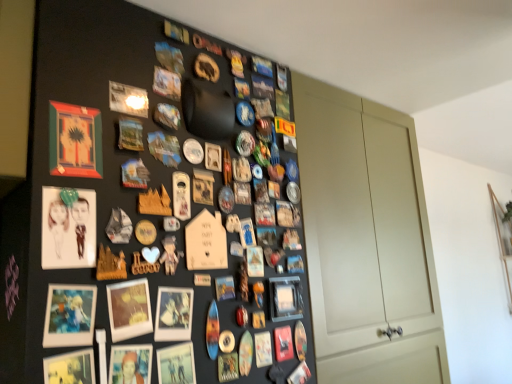
Question: Which is correct: matte wooden picture frame at upper left, arranged as the eighth picture frame when viewed from the right, is inside matte wooden picture frame at center, marked as the 5th picture frame in a left-to-right arrangement, or outside of it?

Choices:
 (A) outside
 (B) inside

Answer: (A)

Question: From a real-world perspective, is matte wooden picture frame at upper left, arranged as the first picture frame when viewed from the left, above or below matte wooden picture frame at center, the fourth picture frame in the right-to-left sequence?

Choices:
 (A) above
 (B) below

Answer: (A)

Question: Considering the real-world distances, which object is farthest from the matte black picture frame at lower right, the first picture frame in the right-to-left sequence?

Choices:
 (A) matte black picture frame at lower left, placed as the fourth picture frame when sorted from left to right
 (B) matte plastic picture frame at lower left, which appears as the 6th picture frame when viewed from the right
 (C) matte white door at center-right
 (D) matte wooden picture frame at center, the fourth picture frame in the right-to-left sequence
 (E) matte plastic picture frame at lower left, which appears as the third picture frame when viewed from the right

Answer: (A)

Question: Based on their relative distances, which object is farther from the matte plastic picture frame at lower left, the 3th picture frame positioned from the left?

Choices:
 (A) matte black picture frame at lower right, positioned as the 8th picture frame in left-to-right order
 (B) matte black picture frame at lower left, positioned as the fifth picture frame in right-to-left order
 (C) matte paper picture frame at left, which is counted as the 2th picture frame, starting from the left
 (D) matte white door at center-right
 (E) matte wooden picture frame at center, marked as the 5th picture frame in a left-to-right arrangement

Answer: (D)